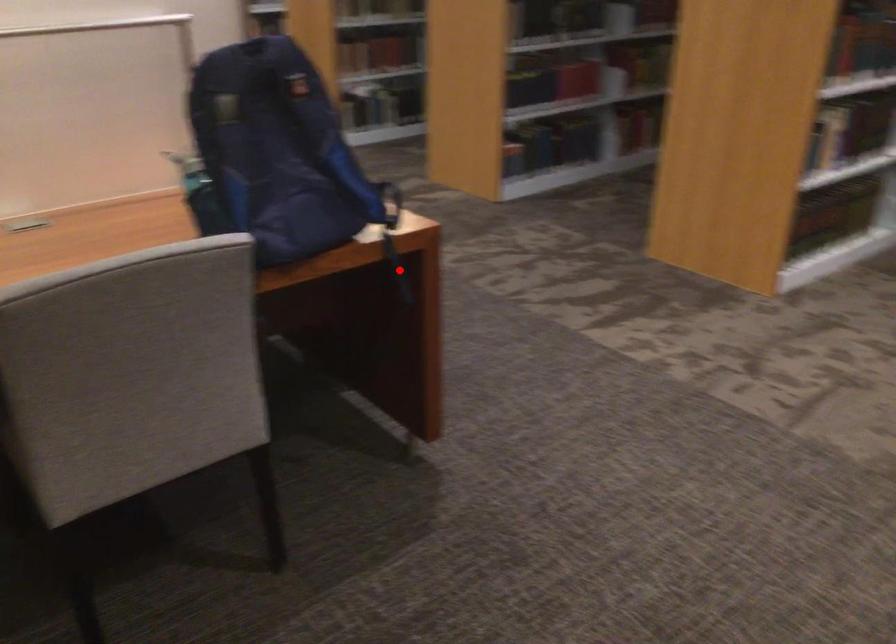
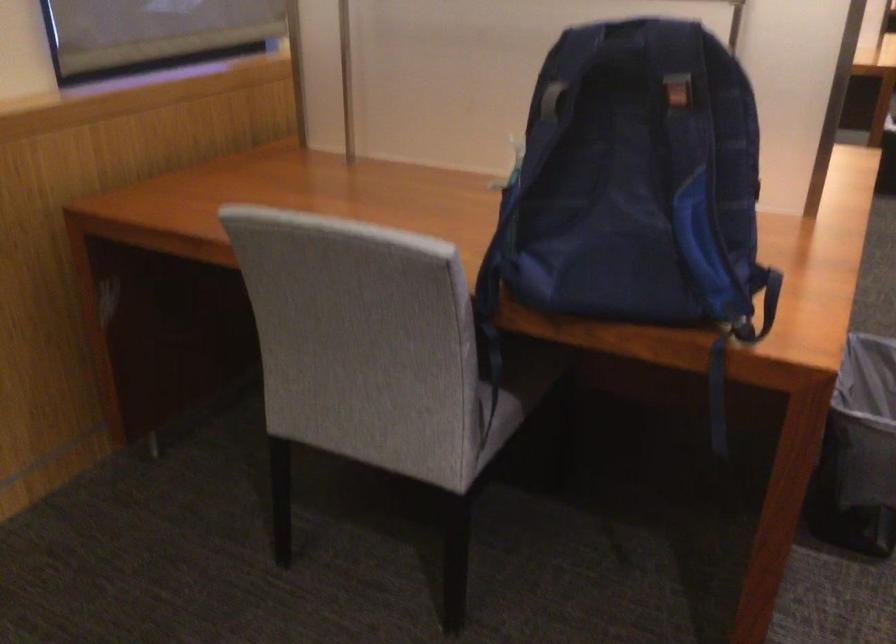
Where in the second image is the point corresponding to the highlighted location from the first image?

(718, 395)